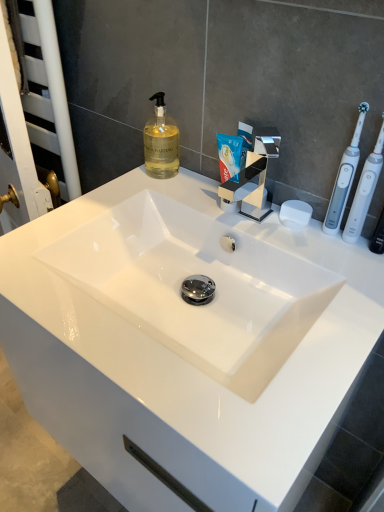
The image size is (384, 512). Find the location of `unoccupied area in front of translucent glass soap dispenser at upper center`. unoccupied area in front of translucent glass soap dispenser at upper center is located at coordinates (140, 198).